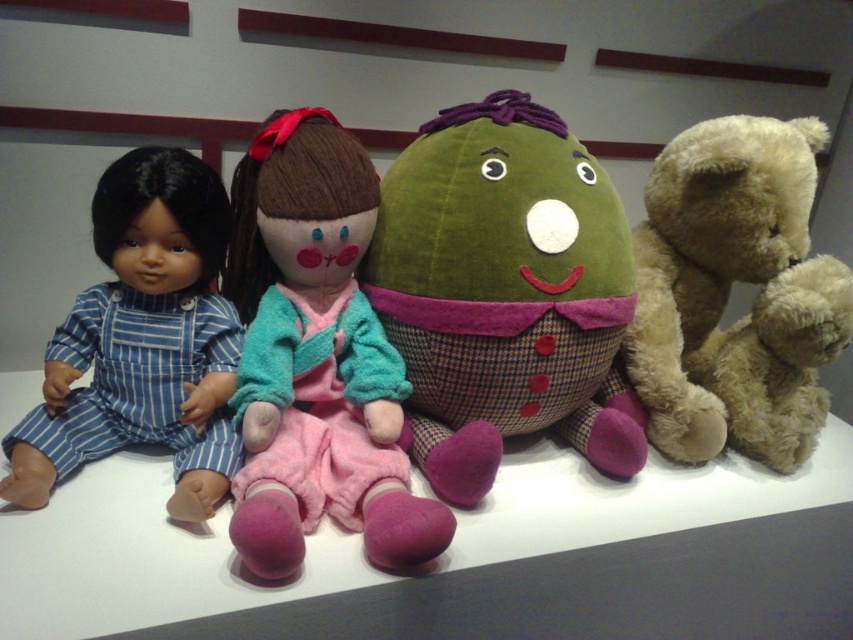
Which is behind, point (265, 433) or point (189, 321)?

The point (189, 321) is more distant.

Who is taller, velvety pink dress at center or matte blue striped overalls at left?

With more height is velvety pink dress at center.

Who is more forward, [311,296] or [213,468]?

Point [213,468]

Locate an element on the screen. velvety pink dress at center is located at coordinates (316, 358).

Who is taller, green velvety plush at center or light brown plush bear at right?

light brown plush bear at right is taller.

Who is shorter, green velvety plush at center or light brown plush bear at right?

green velvety plush at center

Where is `green velvety plush at center`? green velvety plush at center is located at coordinates (503, 292).

Can you confirm if light brown plush bear at right is taller than matte blue striped overalls at left?

Yes, light brown plush bear at right is taller than matte blue striped overalls at left.

Is point (635, 342) closer to camera compared to point (177, 484)?

No, (635, 342) is behind (177, 484).

Find the location of a particular element. Image resolution: width=853 pixels, height=640 pixels. light brown plush bear at right is located at coordinates (728, 292).